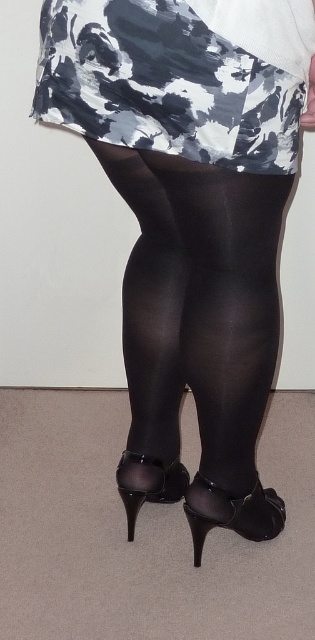
Consider the image. Can you confirm if white and gray abstract fabric at upper center is shorter than black glossy tights at center?

Correct, white and gray abstract fabric at upper center is not as tall as black glossy tights at center.

Is white and gray abstract fabric at upper center wider than black glossy tights at center?

Indeed, white and gray abstract fabric at upper center has a greater width compared to black glossy tights at center.

Find the location of a particular element. The height and width of the screenshot is (640, 315). white and gray abstract fabric at upper center is located at coordinates (179, 76).

Is black sheer tights at center below black glossy tights at center?

Correct, black sheer tights at center is located below black glossy tights at center.

Which is above, black sheer tights at center or black glossy tights at center?

black glossy tights at center is higher up.

Describe the element at coordinates (228, 336) in the screenshot. I see `black sheer tights at center` at that location.

At what (x,y) coordinates should I click in order to perform the action: click on black sheer tights at center. Please return your answer as a coordinate pair (x, y). The width and height of the screenshot is (315, 640). Looking at the image, I should click on (228, 336).

Is black glossy tights at center shorter than black satin stocking at lower center?

Incorrect, black glossy tights at center's height does not fall short of black satin stocking at lower center's.

Does point (153, 227) come in front of point (212, 515)?

Yes, it is in front of point (212, 515).

At what (x,y) coordinates should I click in order to perform the action: click on black glossy tights at center. Please return your answer as a coordinate pair (x, y). Looking at the image, I should click on (148, 336).